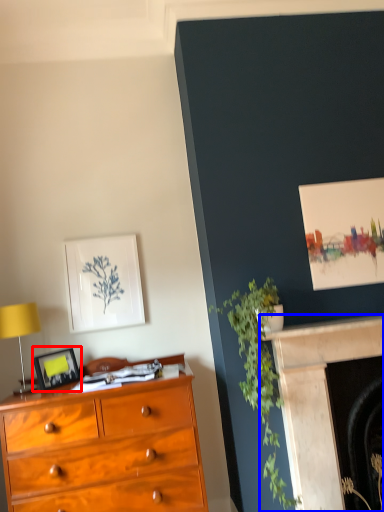
Question: Which of the following is the farthest to the observer, picture frame (highlighted by a red box) or fireplace (highlighted by a blue box)?

Choices:
 (A) picture frame
 (B) fireplace

Answer: (A)